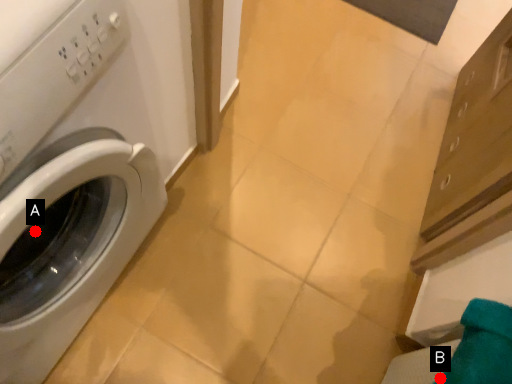
Question: Two points are circled on the image, labeled by A and B beside each circle. Among these points, which one is nearest to the camera?

Choices:
 (A) A is closer
 (B) B is closer

Answer: (B)